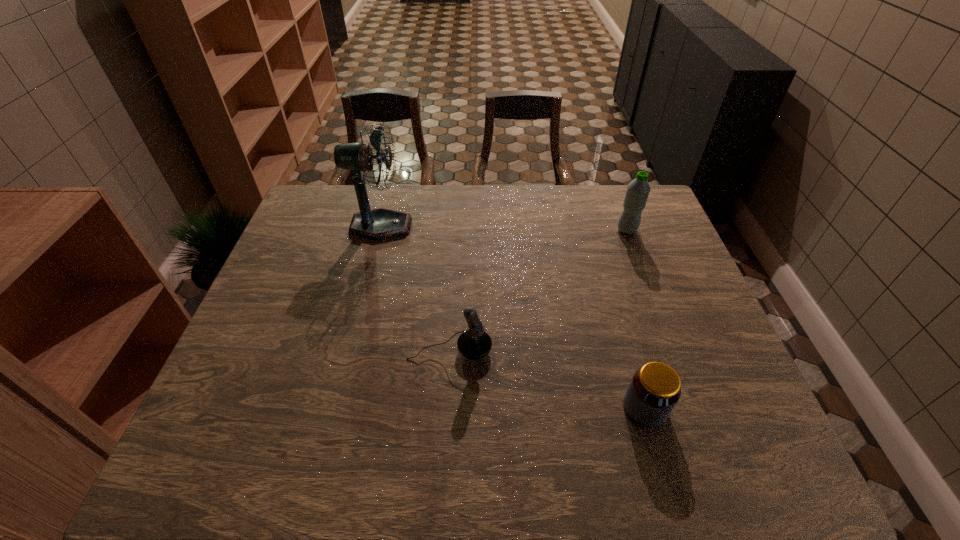
At what (x,y) coordinates should I click in order to perform the action: click on vacant area in the image that satisfies the following two spatial constraints: 1. in front of the third farthest object where the wind blows; 2. on the left side of the tallest object. Please return your answer as a coordinate pair (x, y). This screenshot has height=540, width=960. Looking at the image, I should click on (349, 350).

You are a GUI agent. You are given a task and a screenshot of the screen. Output one action in this format:
    pyautogui.click(x=<x>, y=<y>)
    Task: Click on the free space that satisfies the following two spatial constraints: 1. in front of the water bottle where the wind blows; 2. on the right side of the leftmost object
    The width and height of the screenshot is (960, 540).
    Given the screenshot: What is the action you would take?
    pyautogui.click(x=380, y=230)

This screenshot has height=540, width=960. I want to click on vacant space that satisfies the following two spatial constraints: 1. on the back side of the microphone; 2. on the left side of the second tallest object, so click(x=457, y=230).

Where is `vacant point that satisfies the following two spatial constraints: 1. in front of the tallest object where the wind blows; 2. on the left side of the third object from left to right`? The width and height of the screenshot is (960, 540). vacant point that satisfies the following two spatial constraints: 1. in front of the tallest object where the wind blows; 2. on the left side of the third object from left to right is located at coordinates (335, 408).